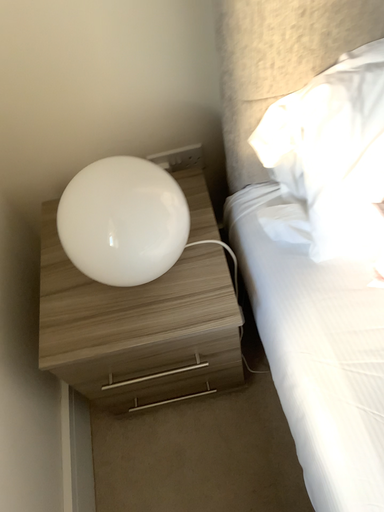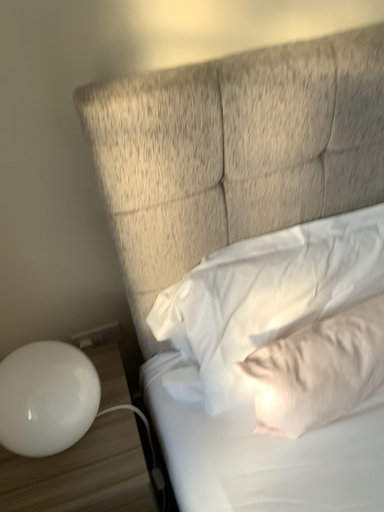
Question: How did the camera likely rotate when shooting the video?

Choices:
 (A) rotated downward
 (B) rotated upward

Answer: (B)